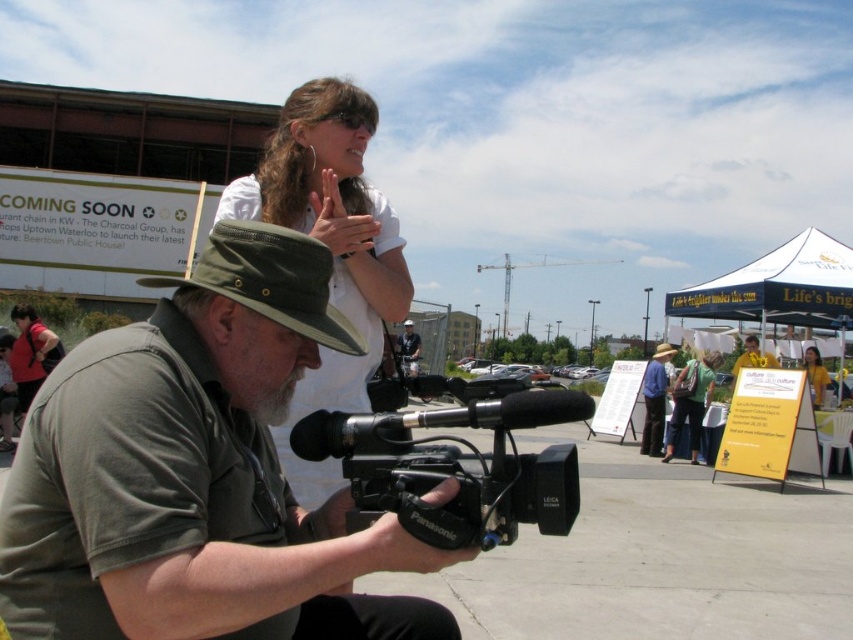
You are a photographer trying to capture a photo of the black plastic video camera at center and the matte red shirt at lower left. Which object should you focus on first if you want to ensure both are in frame without moving the camera?

The black plastic video camera at center has a lesser width compared to the matte red shirt at lower left. Therefore, you should focus on the matte red shirt at lower left first since it is wider and might require more space in the frame to ensure it fits properly while keeping the black plastic video camera at center in view.